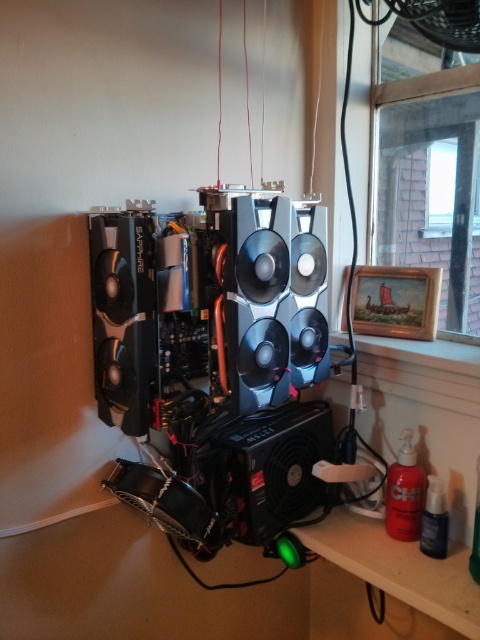
Question: Is black plastic speaker at center to the left of black glossy speaker at center from the viewer's perspective?

Choices:
 (A) yes
 (B) no

Answer: (B)

Question: Estimate the real-world distances between objects in this image. Which object is farther from the black plastic speaker at center?

Choices:
 (A) matte black graphics card at left
 (B) black glossy speaker at center

Answer: (A)

Question: Is black plastic speaker at center positioned before metallic silver speaker at center?

Choices:
 (A) no
 (B) yes

Answer: (A)

Question: Does black plastic speaker at center appear under matte black graphics card at left?

Choices:
 (A) no
 (B) yes

Answer: (B)

Question: Based on their relative distances, which object is farther from the metallic silver speaker at center?

Choices:
 (A) matte black graphics card at left
 (B) black plastic speaker at center

Answer: (A)

Question: Which of these objects is positioned farthest from the metallic silver speaker at center?

Choices:
 (A) black glossy speaker at center
 (B) matte black graphics card at left
 (C) black plastic speaker at center

Answer: (B)